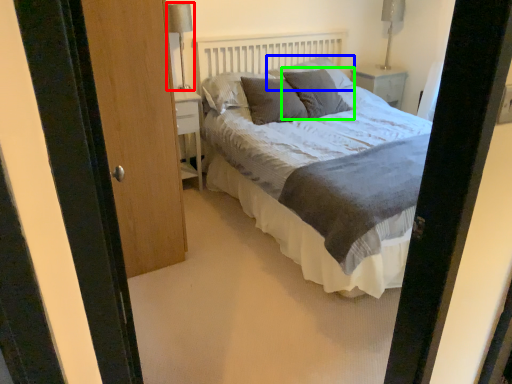
Question: Considering the real-world distances, which object is closest to table lamp (highlighted by a red box)? pillow (highlighted by a blue box) or pillow (highlighted by a green box).

Choices:
 (A) pillow
 (B) pillow

Answer: (A)